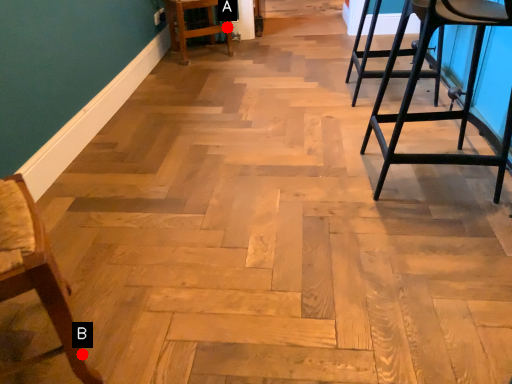
Question: Two points are circled on the image, labeled by A and B beside each circle. Which of the following is the farthest from the observer?

Choices:
 (A) A is further
 (B) B is further

Answer: (A)